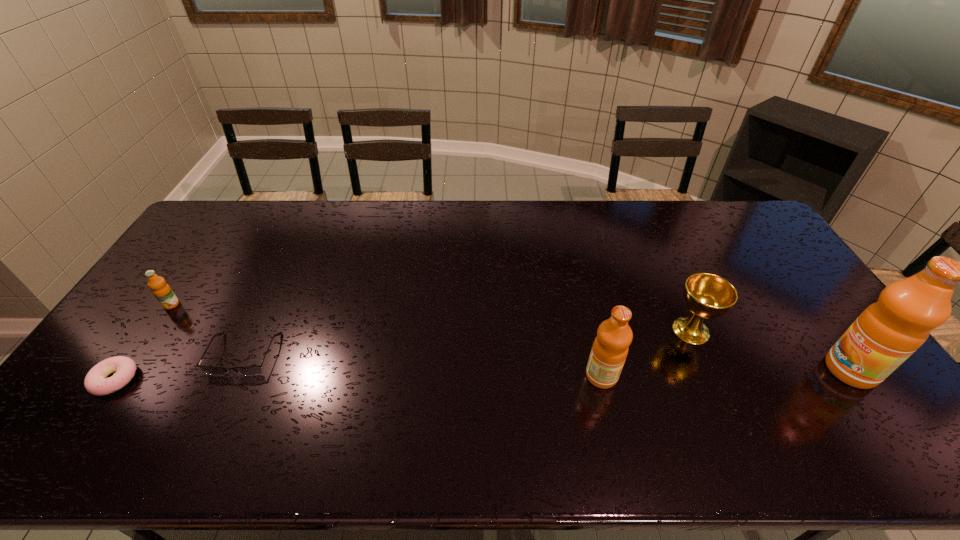
You are a GUI agent. You are given a task and a screenshot of the screen. Output one action in this format:
    pyautogui.click(x=<x>, y=<y>)
    Task: Click on the vacant space located on the label side of the fourth object from left to right
    The image size is (960, 540).
    Given the screenshot: What is the action you would take?
    pyautogui.click(x=743, y=376)

The width and height of the screenshot is (960, 540). I want to click on free region located on the label side of the tallest object, so click(793, 370).

This screenshot has height=540, width=960. In order to click on free space located on the label side of the tallest object in this screenshot , I will do `click(804, 370)`.

Locate an element on the screen. vacant space located 0.280m on the label side of the tallest object is located at coordinates (721, 370).

At what (x,y) coordinates should I click in order to perform the action: click on free region located 0.310m on the label of the third shortest object. Please return your answer as a coordinate pair (x, y). Looking at the image, I should click on (105, 403).

Identify the location of vacant space located 0.090m on the front-facing side of the spectacles. The image size is (960, 540). (218, 409).

Image resolution: width=960 pixels, height=540 pixels. What are the coordinates of `free region located 0.050m on the left of the fourth shortest object` in the screenshot? It's located at [x=651, y=330].

This screenshot has width=960, height=540. In order to click on vacant space located on the right of the doughnut in this screenshot , I will do point(263,380).

Locate an element on the screen. The width and height of the screenshot is (960, 540). doughnut located in the near edge section of the desktop is located at coordinates (96, 383).

This screenshot has height=540, width=960. In order to click on orange juice positioned at the left edge in this screenshot , I will do `click(161, 290)`.